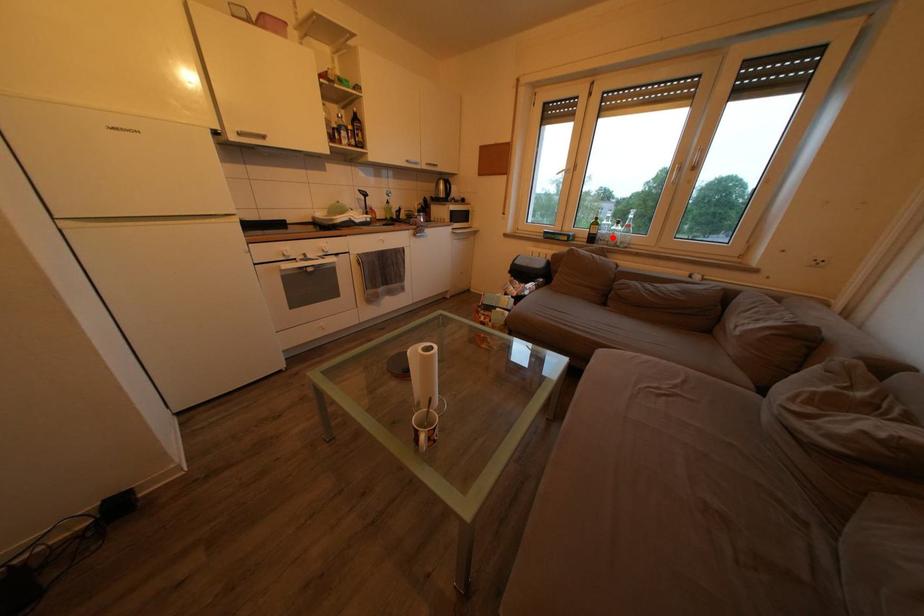
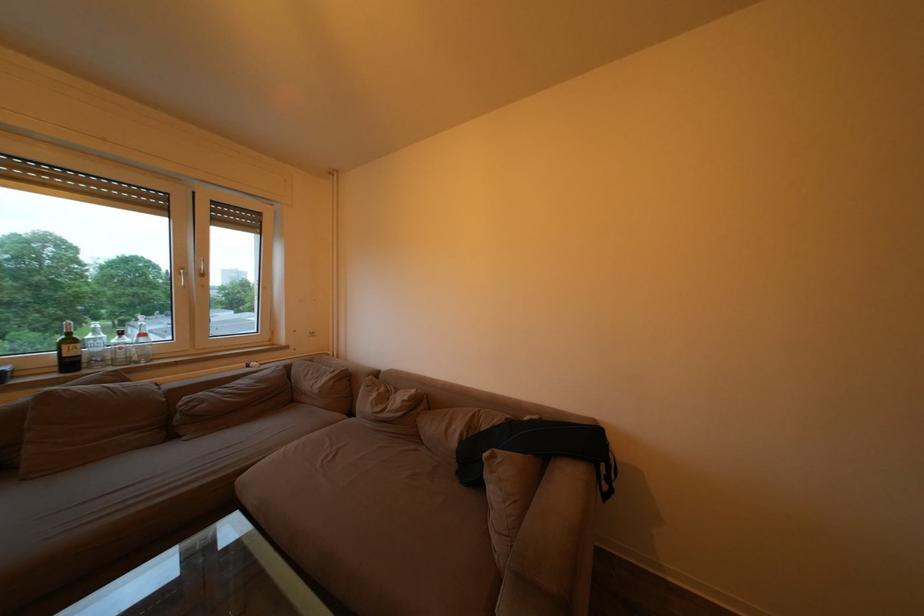
Question: I am providing you with two images of the same scene from different viewpoints. Image1 has a red point marked. In image2, the corresponding 3D location appears at what relative position? Reply with the corresponding letter.

Choices:
 (A) Closer
 (B) Farther

Answer: (B)